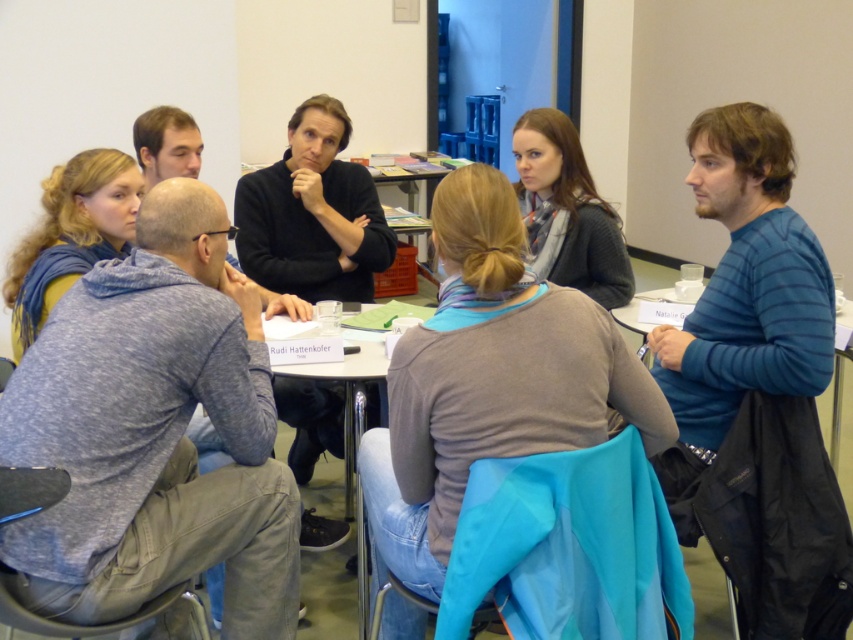
You are organizing a small event and need to place a decorative centerpiece on the metallic silver table at center. Considering the size of the knitted gray sweater at center, will the centerpiece fit on the table without overhanging the edges?

The knitted gray sweater at center is wider than the metallic silver table at center. Since the sweater already occupies more width than the table, placing a centerpiece might cause it to overhang the edges unless the centerpiece is smaller than the table.

You are sitting at the metallic silver table at center and want to hand a document to the person wearing the blue scarf at upper left. Can you reach them directly without moving from your seat?

The blue scarf at upper left is further to the viewer than metallic silver table at center, meaning it is closer to you. Since it is closer, you can likely reach them directly without needing to move from your seat.